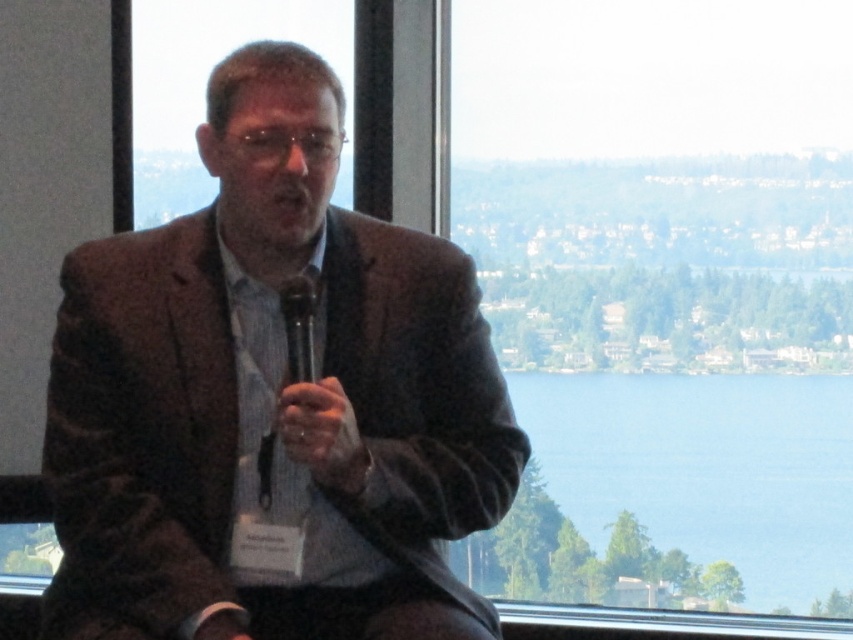
Question: Does textured brown blazer at center have a larger size compared to blue water at center?

Choices:
 (A) yes
 (B) no

Answer: (B)

Question: From the image, what is the correct spatial relationship of blue water at center in relation to black plastic microphone at center?

Choices:
 (A) above
 (B) below

Answer: (B)

Question: Which point is closer to the camera?

Choices:
 (A) (296, 444)
 (B) (758, 468)

Answer: (A)

Question: Which object is closer to the camera taking this photo?

Choices:
 (A) textured brown blazer at center
 (B) blue water at center

Answer: (A)

Question: Is textured brown blazer at center thinner than blue water at center?

Choices:
 (A) no
 (B) yes

Answer: (B)

Question: Based on their relative distances, which object is nearer to the black plastic microphone at center?

Choices:
 (A) blue water at center
 (B) textured brown blazer at center

Answer: (B)